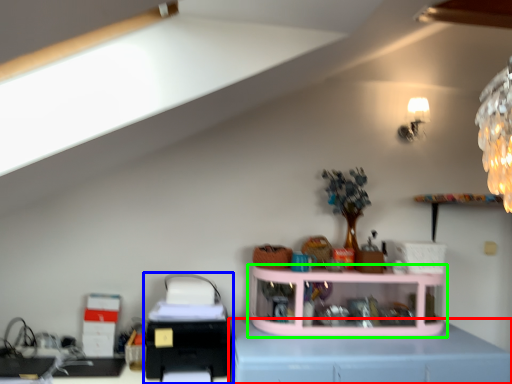
Question: Which object is positioned farthest from computer desk (highlighted by a red box)? Select from printer (highlighted by a blue box) and shelf (highlighted by a green box).

Choices:
 (A) printer
 (B) shelf

Answer: (A)